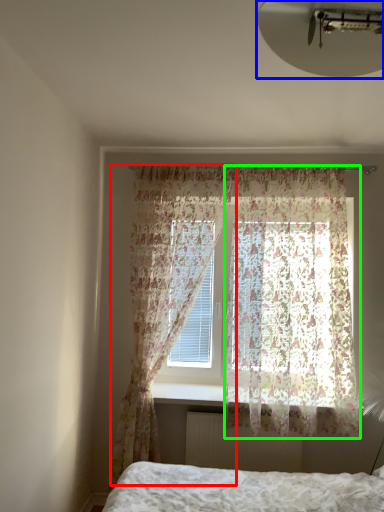
Question: Considering the real-world distances, which object is closest to curtain (highlighted by a red box)? light fixture (highlighted by a blue box) or curtain (highlighted by a green box).

Choices:
 (A) light fixture
 (B) curtain

Answer: (B)